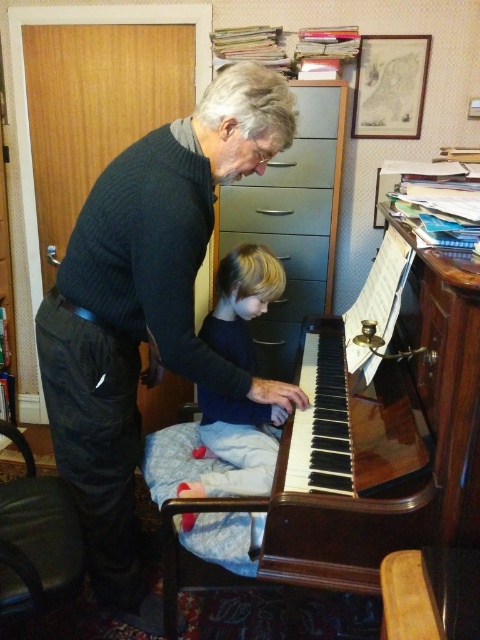
Question: Considering the real-world distances, which object is closest to the mahogany polished piano at center?

Choices:
 (A) dark gray sweater at center
 (B) matte gray drawer at center
 (C) metallic gray drawer at center
 (D) dark blue sweater at center

Answer: (D)

Question: Estimate the real-world distances between objects in this image. Which object is closer to the dark blue sweater at center?

Choices:
 (A) matte gray drawer at center
 (B) dark gray sweater at center
 (C) mahogany polished piano at center

Answer: (C)

Question: Does mahogany polished piano at center come in front of metallic gray drawer at center?

Choices:
 (A) no
 (B) yes

Answer: (B)

Question: Which point is farther to the camera?

Choices:
 (A) (x=335, y=568)
 (B) (x=210, y=412)
 (C) (x=228, y=198)
 (D) (x=97, y=289)

Answer: (C)

Question: Is dark blue sweater at center positioned behind matte gray drawer at center?

Choices:
 (A) no
 (B) yes

Answer: (A)

Question: Can you confirm if mahogany polished piano at center is bigger than matte gray drawer at center?

Choices:
 (A) no
 (B) yes

Answer: (B)